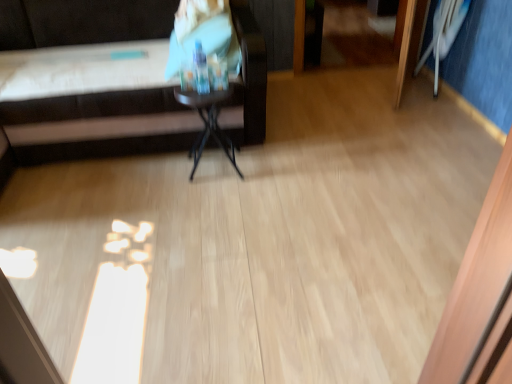
Where is `vacant area situated below white plastic swivel chair at upper right (from a real-world perspective)`? The image size is (512, 384). vacant area situated below white plastic swivel chair at upper right (from a real-world perspective) is located at coordinates (434, 89).